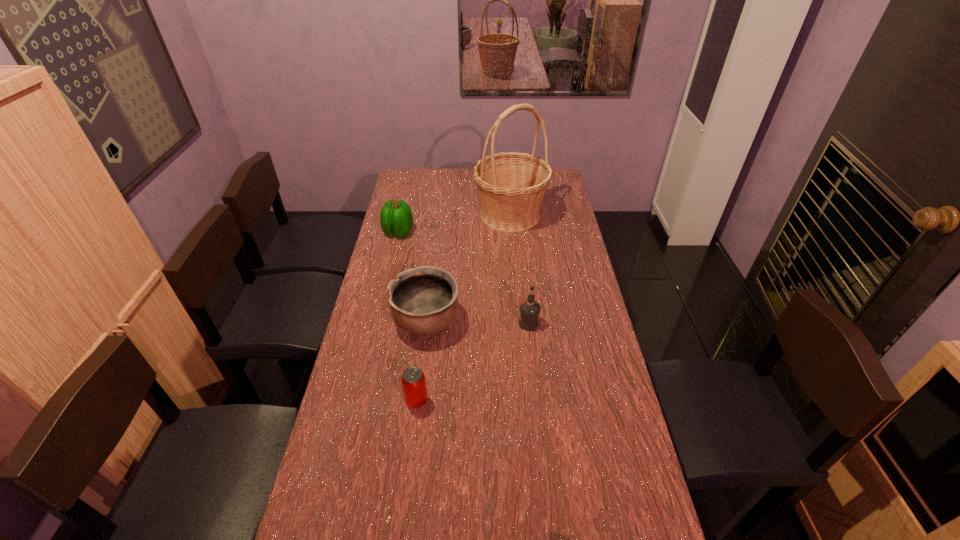
The height and width of the screenshot is (540, 960). Find the location of `vacant space situated on the right of the bell pepper`. vacant space situated on the right of the bell pepper is located at coordinates 497,233.

What are the coordinates of `vacant area located on the right of the pottery` in the screenshot? It's located at pos(561,321).

The image size is (960, 540). Find the location of `free space located on the back of the can`. free space located on the back of the can is located at coordinates (426, 321).

The height and width of the screenshot is (540, 960). What are the coordinates of `bell pepper that is at the left edge` in the screenshot? It's located at (396, 219).

You are a GUI agent. You are given a task and a screenshot of the screen. Output one action in this format:
    pyautogui.click(x=<x>, y=<y>)
    Task: Click on the pottery at the left edge
    This screenshot has width=960, height=540.
    Given the screenshot: What is the action you would take?
    pyautogui.click(x=423, y=300)

Find the location of `object that is at the right edge`. object that is at the right edge is located at coordinates (511, 185).

In the image, there is a desktop. Where is `free space at the left edge`? free space at the left edge is located at coordinates (377, 387).

Locate an element on the screen. This screenshot has height=540, width=960. free spot at the right edge of the desktop is located at coordinates (562, 339).

This screenshot has width=960, height=540. Find the location of `vacant area at the far left corner`. vacant area at the far left corner is located at coordinates (416, 191).

Image resolution: width=960 pixels, height=540 pixels. Find the location of `free space between the pottery and the vodka`. free space between the pottery and the vodka is located at coordinates (477, 322).